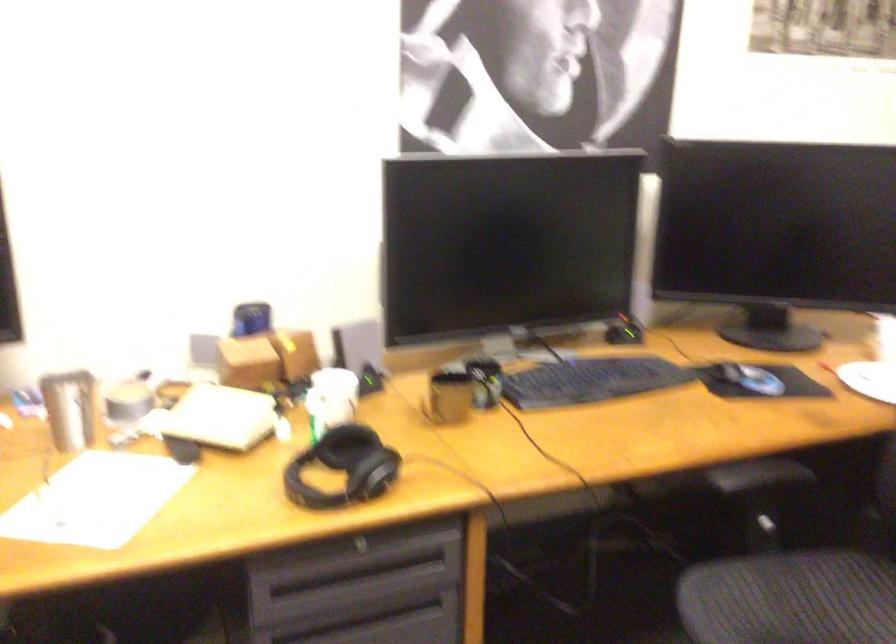
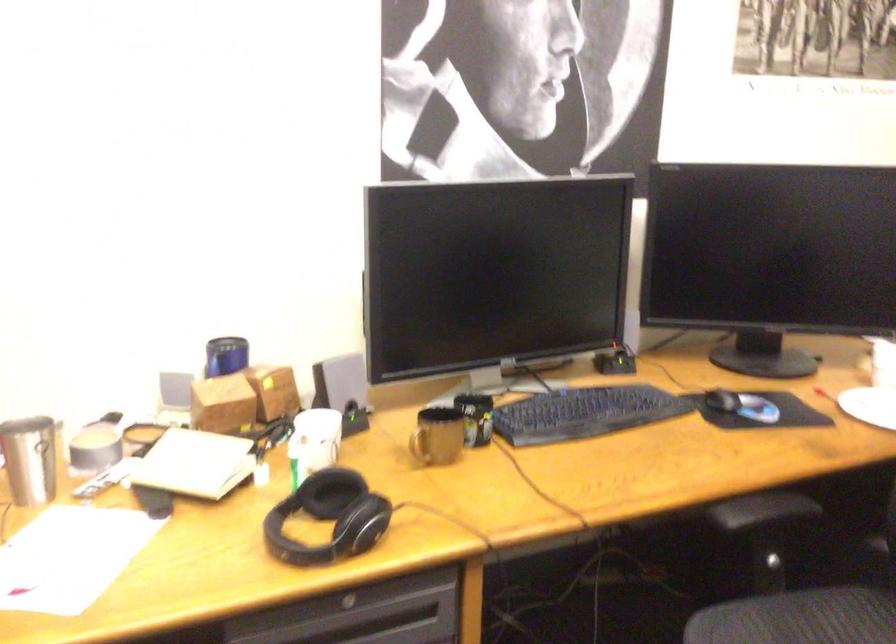
The point at (355, 547) is marked in the first image. Where is the corresponding point in the second image?

(347, 603)